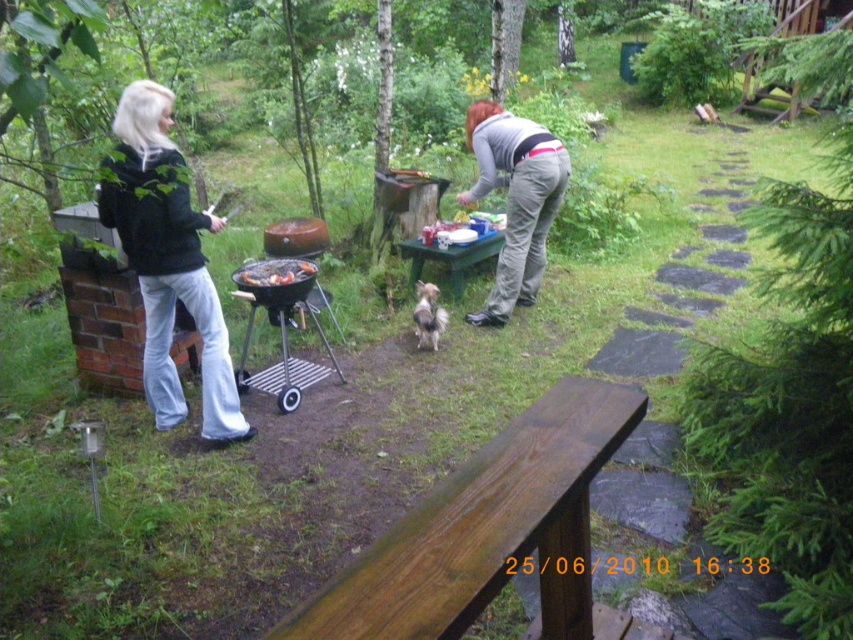
Question: Can you confirm if black matte jacket at left is bigger than fluffy white dog at center?

Choices:
 (A) yes
 (B) no

Answer: (A)

Question: Which point appears closest to the camera in this image?

Choices:
 (A) (165, 323)
 (B) (515, 157)

Answer: (A)

Question: Which point is closer to the camera?

Choices:
 (A) [x=198, y=264]
 (B) [x=291, y=272]
 (C) [x=463, y=596]
 (D) [x=422, y=285]

Answer: (C)

Question: Can you confirm if black matte jacket at left is thinner than fluffy white dog at center?

Choices:
 (A) no
 (B) yes

Answer: (A)

Question: Observing the image, what is the correct spatial positioning of gray cotton pants at center in reference to grilled meat at center?

Choices:
 (A) right
 (B) left

Answer: (A)

Question: Which point appears farthest from the camera in this image?

Choices:
 (A) (137, 125)
 (B) (538, 477)
 (C) (492, 241)
 (D) (426, 328)

Answer: (C)